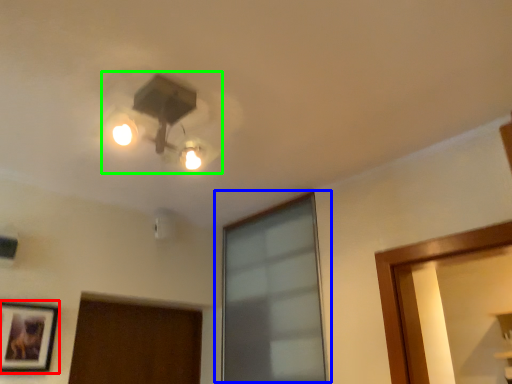
Question: Which object is the farthest from picture frame (highlighted by a red box)? Choose among these: window (highlighted by a blue box) or lamp (highlighted by a green box).

Choices:
 (A) window
 (B) lamp

Answer: (A)